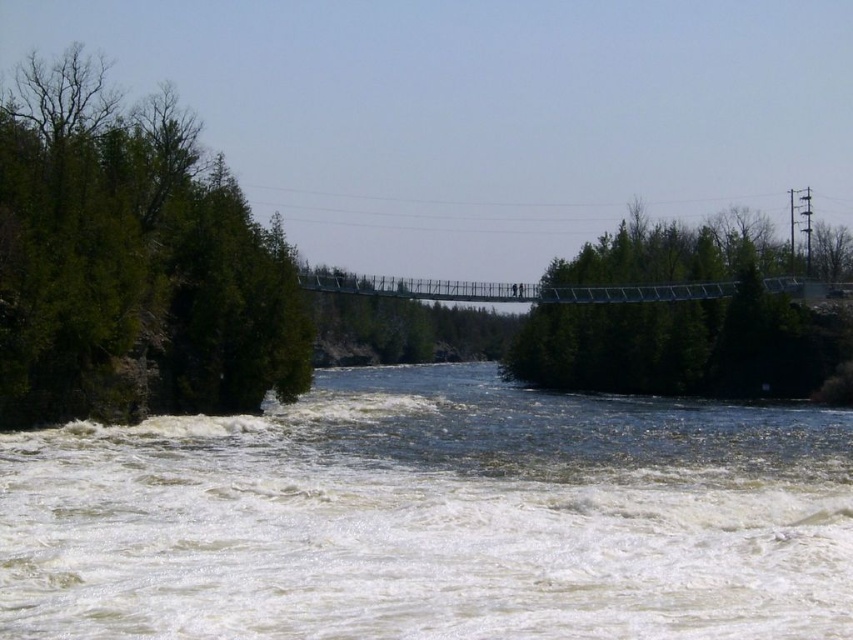
Can you confirm if green leafy tree at left is positioned to the right of green leafy trees at center?

Incorrect, green leafy tree at left is not on the right side of green leafy trees at center.

Between point (0, 266) and point (843, 268), which one is positioned in front?

Point (0, 266) is in front.

Locate an element on the screen. green leafy tree at left is located at coordinates click(x=132, y=262).

Can you confirm if white frothy water at lower center is shorter than green leafy tree at left?

Indeed, white frothy water at lower center has a lesser height compared to green leafy tree at left.

Which of these two, white frothy water at lower center or green leafy tree at left, stands shorter?

Standing shorter between the two is white frothy water at lower center.

Who is more forward, (563,509) or (49,148)?

Point (563,509) is more forward.

You are a GUI agent. You are given a task and a screenshot of the screen. Output one action in this format:
    pyautogui.click(x=<x>, y=<y>)
    Task: Click on the white frothy water at lower center
    The image size is (853, 640).
    Given the screenshot: What is the action you would take?
    pyautogui.click(x=433, y=518)

Does white frothy water at lower center have a smaller size compared to green leafy trees at center?

Indeed, white frothy water at lower center has a smaller size compared to green leafy trees at center.

Between white frothy water at lower center and green leafy trees at center, which one appears on the right side from the viewer's perspective?

Positioned to the right is green leafy trees at center.

Does point (207, 449) come farther from viewer compared to point (659, 312)?

That is False.

The image size is (853, 640). Find the location of `white frothy water at lower center`. white frothy water at lower center is located at coordinates (433, 518).